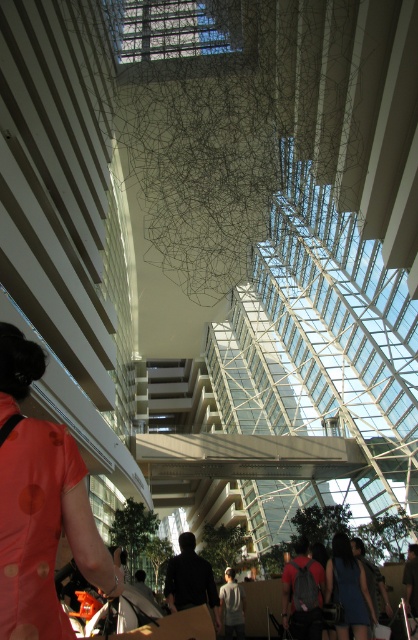
Does point (12, 412) lie in front of point (357, 636)?

Yes.

Identify the location of orange dotted shirt at lower left. The width and height of the screenshot is (418, 640). 43,529.

Find the location of a particular element. orange dotted shirt at lower left is located at coordinates (43, 529).